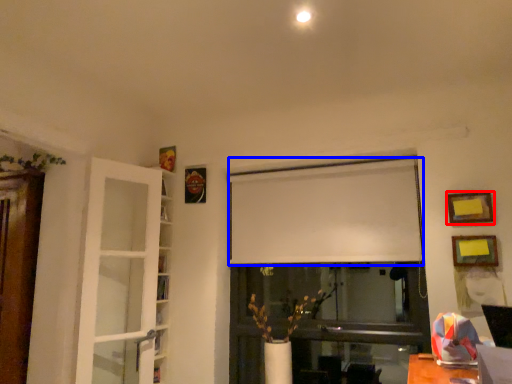
Question: Which of the following is the closest to the observer, picture frame (highlighted by a red box) or curtain (highlighted by a blue box)?

Choices:
 (A) picture frame
 (B) curtain

Answer: (A)